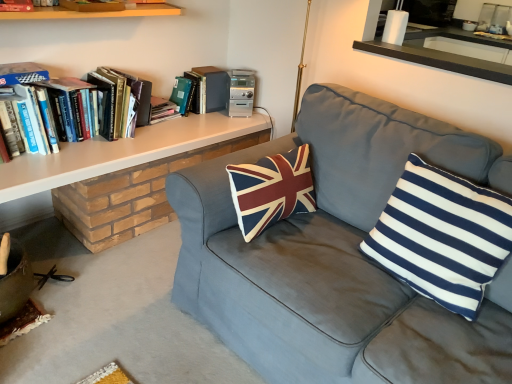
I want to click on hardcover book at upper left, the fourth book when ordered from back to front, so click(x=16, y=6).

The image size is (512, 384). Describe the element at coordinates (442, 236) in the screenshot. I see `white/blue striped pillow at right` at that location.

You are a GUI agent. You are given a task and a screenshot of the screen. Output one action in this format:
    pyautogui.click(x=<x>, y=<y>)
    Task: Click on the white glossy mirror at upper right
    
    Given the screenshot: What is the action you would take?
    pyautogui.click(x=429, y=54)

This screenshot has width=512, height=384. What do you see at coordinates (208, 89) in the screenshot?
I see `hardcover book at upper center, the 4th book positioned from the front` at bounding box center [208, 89].

Locate an element on the screen. This screenshot has height=384, width=512. matte gray couch at center is located at coordinates (337, 256).

From a real-world perspective, who is located lower, white glossy mirror at upper right or matte gray couch at center?

In real-world perspective, matte gray couch at center is lower.

Can you confirm if white glossy mirror at upper right is taller than matte gray couch at center?

No, white glossy mirror at upper right is not taller than matte gray couch at center.

Which is in front, point (459, 72) or point (205, 186)?

The point (205, 186) is in front.

How much distance is there between white glossy mirror at upper right and matte gray couch at center?

They are 3.30 feet apart.

Which point is more distant from viewer, (x=272, y=294) or (x=20, y=9)?

Point (x=20, y=9)

Is matte gray couch at center at the right side of hardcover book at upper left, the fourth book when ordered from back to front?

Yes, matte gray couch at center is to the right of hardcover book at upper left, the fourth book when ordered from back to front.

From the image's perspective, is matte gray couch at center located above or below hardcover book at upper left, the fourth book when ordered from back to front?

Clearly, from the image's perspective, matte gray couch at center is below hardcover book at upper left, the fourth book when ordered from back to front.

Who is smaller, white/blue striped pillow at right or matte gray couch at center?

white/blue striped pillow at right.

Consider the image. What's the angular difference between white/blue striped pillow at right and matte gray couch at center's facing directions?

The angular difference between white/blue striped pillow at right and matte gray couch at center is 0.0816 degrees.

Is white/blue striped pillow at right taller than matte gray couch at center?

No, white/blue striped pillow at right is not taller than matte gray couch at center.

Is the position of white/blue striped pillow at right more distant than that of matte gray couch at center?

Yes, it is behind matte gray couch at center.

Is hardcover book at upper center, acting as the first book starting from the back, to the left or to the right of matte gray couch at center in the image?

hardcover book at upper center, acting as the first book starting from the back, is to the left of matte gray couch at center.

Is hardcover book at upper center, acting as the first book starting from the back, touching matte gray couch at center?

There is a gap between hardcover book at upper center, acting as the first book starting from the back, and matte gray couch at center.

Is hardcover book at upper center, acting as the first book starting from the back, oriented towards matte gray couch at center?

Yes, hardcover book at upper center, acting as the first book starting from the back, is oriented towards matte gray couch at center.

Does point (206, 103) lie in front of point (338, 182)?

No, (206, 103) is behind (338, 182).

From the image's perspective, is white glossy mirror at upper right below white matte shelf at upper left?

No, from the image's perspective, white glossy mirror at upper right is not beneath white matte shelf at upper left.

Which object is further away from the camera, white glossy mirror at upper right or white matte shelf at upper left?

white glossy mirror at upper right is further away from the camera.

Is white glossy mirror at upper right wider or thinner than white matte shelf at upper left?

Clearly, white glossy mirror at upper right has less width compared to white matte shelf at upper left.

Choose the correct answer: Is white glossy mirror at upper right inside white matte shelf at upper left or outside it?

white glossy mirror at upper right is spatially situated outside white matte shelf at upper left.

Between hardcover book at upper center, acting as the first book starting from the back, and hardcover books at left, the third book when ordered from back to front, which one has larger size?

hardcover books at left, the third book when ordered from back to front.

Consider the image. From the image's perspective, which object appears higher, hardcover book at upper center, the 4th book positioned from the front, or hardcover books at left, marked as the 2th book in a front-to-back arrangement?

hardcover book at upper center, the 4th book positioned from the front, appears higher in the image.

Is hardcover books at left, marked as the 2th book in a front-to-back arrangement, at the back of hardcover book at upper center, acting as the first book starting from the back?

No, hardcover book at upper center, acting as the first book starting from the back, is not facing away from hardcover books at left, marked as the 2th book in a front-to-back arrangement.

Between hardcover book at upper center, the 4th book positioned from the front, and hardcover books at left, marked as the 2th book in a front-to-back arrangement, which one has larger width?

hardcover books at left, marked as the 2th book in a front-to-back arrangement, is wider.

Where is `the 2nd book positioned above the hardcover books at left, the third book when ordered from back to front (from the image's perspective)`? Image resolution: width=512 pixels, height=384 pixels. the 2nd book positioned above the hardcover books at left, the third book when ordered from back to front (from the image's perspective) is located at coordinates pyautogui.click(x=208, y=89).

Which of these two, hardcover books at left, the third book when ordered from back to front, or hardcover book at upper center, acting as the first book starting from the back, stands taller?

Standing taller between the two is hardcover books at left, the third book when ordered from back to front.

Can you confirm if hardcover books at left, marked as the 2th book in a front-to-back arrangement, is smaller than hardcover book at upper center, the 4th book positioned from the front?

Incorrect, hardcover books at left, marked as the 2th book in a front-to-back arrangement, is not smaller in size than hardcover book at upper center, the 4th book positioned from the front.

Identify the location of studio couch to the left of white glossy mirror at upper right. (337, 256).

Locate an element on the screen. the 4th book above the matte gray couch at center (from a real-world perspective) is located at coordinates (16, 6).

Looking at the image, which one is located further to matte gray couch at center, white matte shelf at upper left or hardcover book at upper center, the 4th book positioned from the front?

hardcover book at upper center, the 4th book positioned from the front, is further to matte gray couch at center.

From the image, which object appears to be farther from hardcover book at upper left, the third book viewed from the front, hardcover book at upper left, which ranks as the first book in front-to-back order, or matte gray couch at center?

Among the two, matte gray couch at center is located further to hardcover book at upper left, the third book viewed from the front.

When comparing their distances from hardcover book at upper center, the 4th book positioned from the front, does white/blue striped pillow at right or matte gray couch at center seem further?

white/blue striped pillow at right.

In the scene shown: Which object lies further to the anchor point white glossy mirror at upper right, white matte shelf at upper left or matte gray couch at center?

Based on the image, white matte shelf at upper left appears to be further to white glossy mirror at upper right.

Considering their positions, is white glossy mirror at upper right positioned closer to matte gray couch at center than hardcover books at left, marked as the 2th book in a front-to-back arrangement?

white glossy mirror at upper right is positioned closer to the anchor matte gray couch at center.

Which object lies further to the anchor point hardcover book at upper left, the fourth book when ordered from back to front, hardcover book at upper left, which ranks as the second book in back-to-front order, or white matte shelf at upper left?

Based on the image, hardcover book at upper left, which ranks as the second book in back-to-front order, appears to be further to hardcover book at upper left, the fourth book when ordered from back to front.

Looking at the image, which one is located closer to matte gray couch at center, hardcover book at upper left, the fourth book when ordered from back to front, or white matte shelf at upper left?

white matte shelf at upper left is closer to matte gray couch at center.

Based on their spatial positions, is hardcover book at upper left, the fourth book when ordered from back to front, or hardcover books at left, the third book when ordered from back to front, further from hardcover book at upper center, acting as the first book starting from the back?

hardcover book at upper left, the fourth book when ordered from back to front, lies further to hardcover book at upper center, acting as the first book starting from the back, than the other object.

The image size is (512, 384). I want to click on studio couch between hardcover books at left, the third book when ordered from back to front, and white/blue striped pillow at right, in the horizontal direction, so click(337, 256).

Locate an element on the screen. table between hardcover books at left, the third book when ordered from back to front, and hardcover book at upper left, which ranks as the second book in back-to-front order, in the front-back direction is located at coordinates point(138,174).

You are a GUI agent. You are given a task and a screenshot of the screen. Output one action in this format:
    pyautogui.click(x=<x>, y=<y>)
    Task: Click on the pillow between matte gray couch at center and hardcover book at upper center, the 4th book positioned from the front, along the z-axis
    
    Given the screenshot: What is the action you would take?
    point(442,236)

Locate an element on the screen. table situated between hardcover book at upper left, which ranks as the first book in front-to-back order, and white glossy mirror at upper right from left to right is located at coordinates (138, 174).